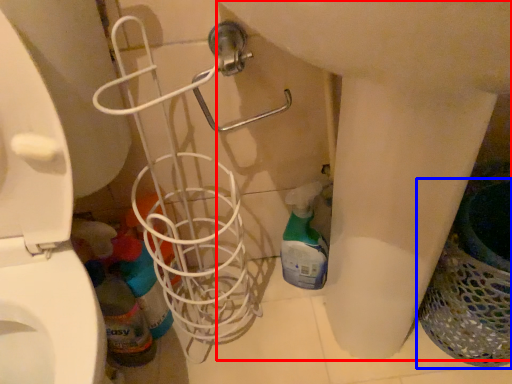
Question: Which object appears closest to the camera in this image, sink (highlighted by a red box) or laundry basket (highlighted by a blue box)?

Choices:
 (A) sink
 (B) laundry basket

Answer: (A)